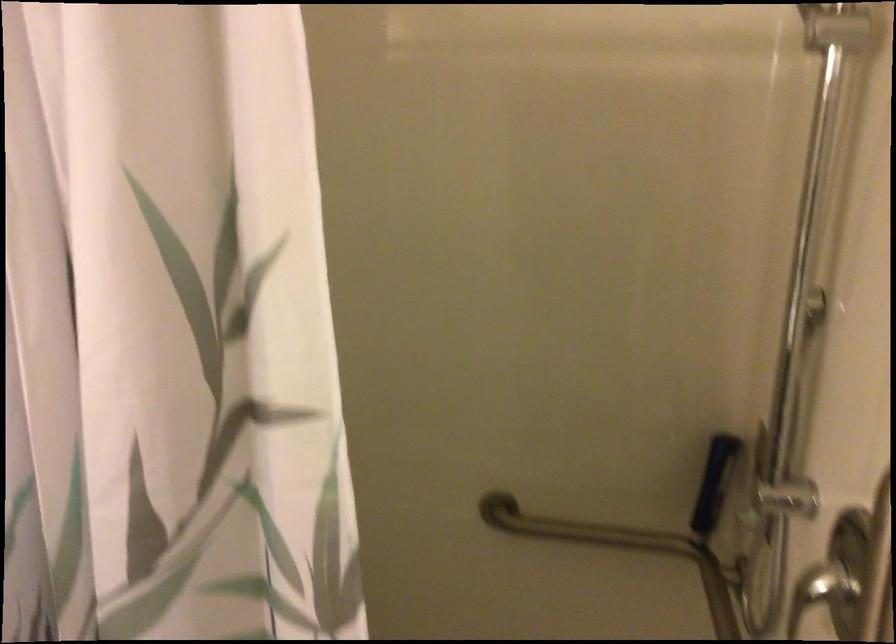
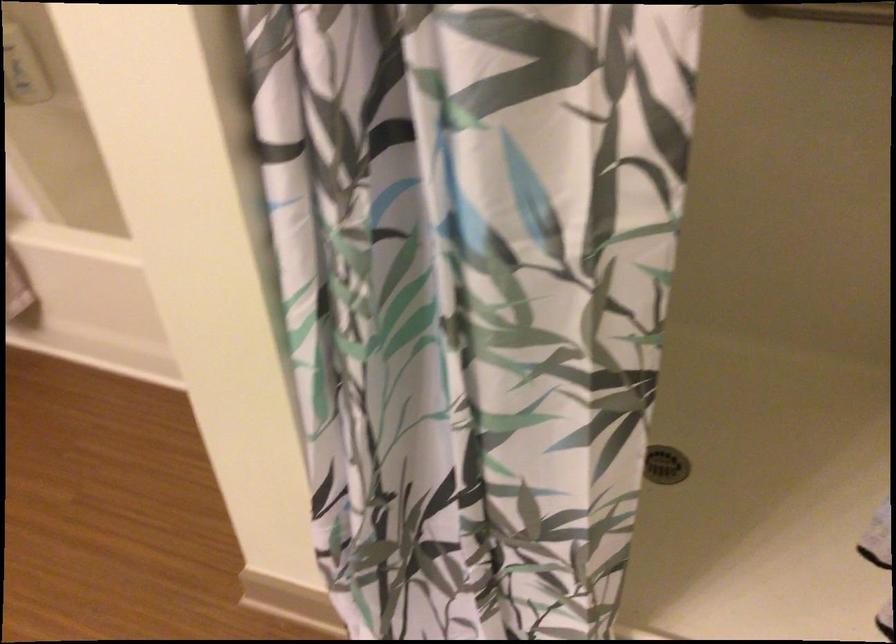
Question: The images are taken continuously from a first-person perspective. In which direction are you moving?

Choices:
 (A) Left
 (B) Right
 (C) Forward
 (D) Backward

Answer: (A)